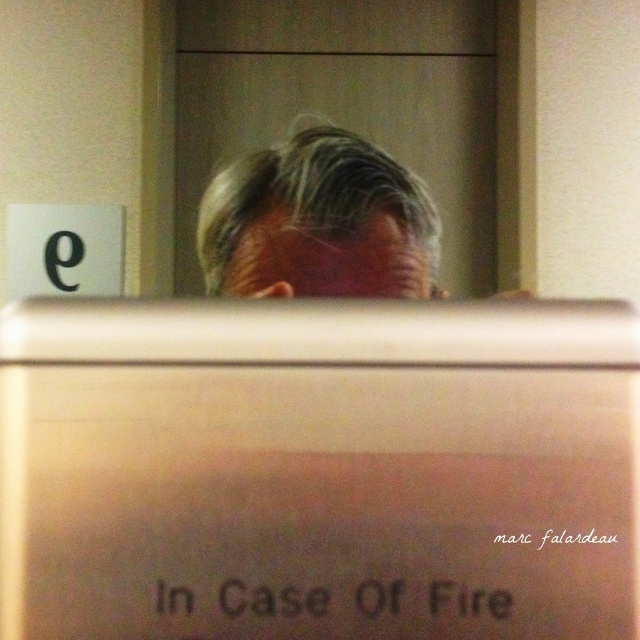
Question: Does metallic silver computer screen at center have a lesser width compared to gray matte hair at center?

Choices:
 (A) yes
 (B) no

Answer: (B)

Question: Does metallic silver computer screen at center appear on the right side of gray matte hair at center?

Choices:
 (A) yes
 (B) no

Answer: (A)

Question: Which point is closer to the camera?

Choices:
 (A) metallic silver computer screen at center
 (B) gray matte hair at center

Answer: (A)

Question: Does metallic silver computer screen at center appear under gray matte hair at center?

Choices:
 (A) yes
 (B) no

Answer: (A)